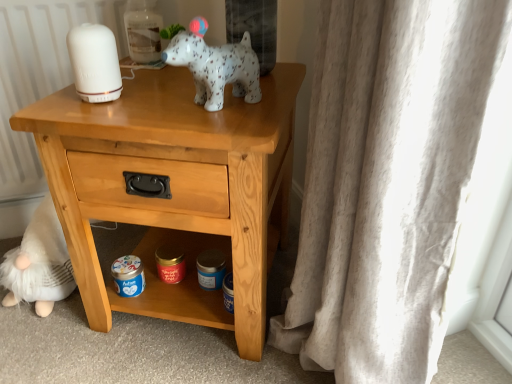
Question: Considering the positions of white fluffy gnome at lower left and light wood nightstand at center in the image, is white fluffy gnome at lower left wider or thinner than light wood nightstand at center?

Choices:
 (A) wide
 (B) thin

Answer: (B)

Question: Is white fluffy gnome at lower left taller or shorter than light wood nightstand at center?

Choices:
 (A) tall
 (B) short

Answer: (B)

Question: Based on their relative distances, which object is nearer to the white matte bottle at upper center?

Choices:
 (A) white fluffy gnome at lower left
 (B) white speckled ceramic dog at upper center
 (C) light wood nightstand at center

Answer: (B)

Question: Based on their relative distances, which object is farther from the white speckled ceramic dog at upper center?

Choices:
 (A) white fluffy gnome at lower left
 (B) light wood nightstand at center
 (C) white matte bottle at upper center

Answer: (A)